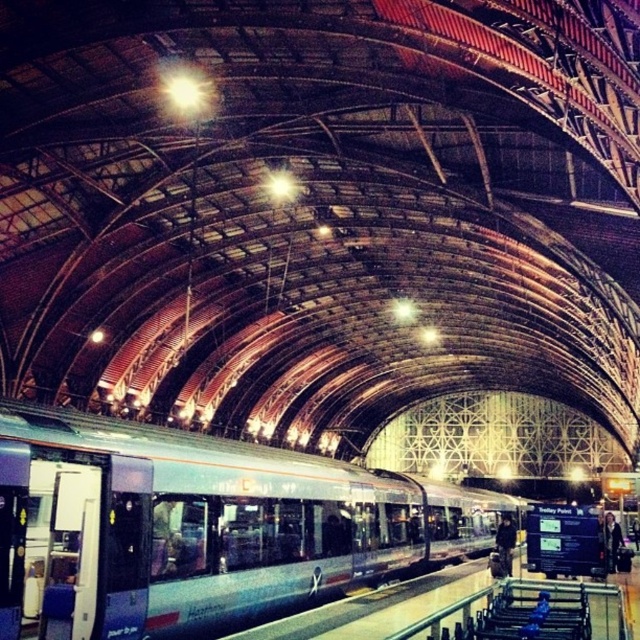
Question: Which point is closer to the camera?

Choices:
 (A) dark brown leather jacket at center
 (B) silver metallic train at center

Answer: (B)

Question: Is silver metallic train at center to the left of dark hair at platform right from the viewer's perspective?

Choices:
 (A) yes
 (B) no

Answer: (A)

Question: Which point is closer to the camera taking this photo?

Choices:
 (A) (502, 538)
 (B) (604, 515)

Answer: (B)

Question: Is silver metallic train at center to the right of dark hair at platform right from the viewer's perspective?

Choices:
 (A) yes
 (B) no

Answer: (B)

Question: Which of the following is the closest to the observer?

Choices:
 (A) dark hair at platform right
 (B) dark brown leather jacket at center

Answer: (A)

Question: Considering the relative positions of silver metallic train at center and dark hair at platform right in the image provided, where is silver metallic train at center located with respect to dark hair at platform right?

Choices:
 (A) right
 (B) left

Answer: (B)